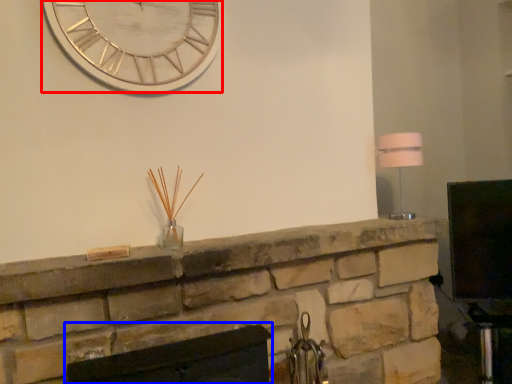
Question: Among these objects, which one is farthest to the camera, wall clock (highlighted by a red box) or fireplace (highlighted by a blue box)?

Choices:
 (A) wall clock
 (B) fireplace

Answer: (A)